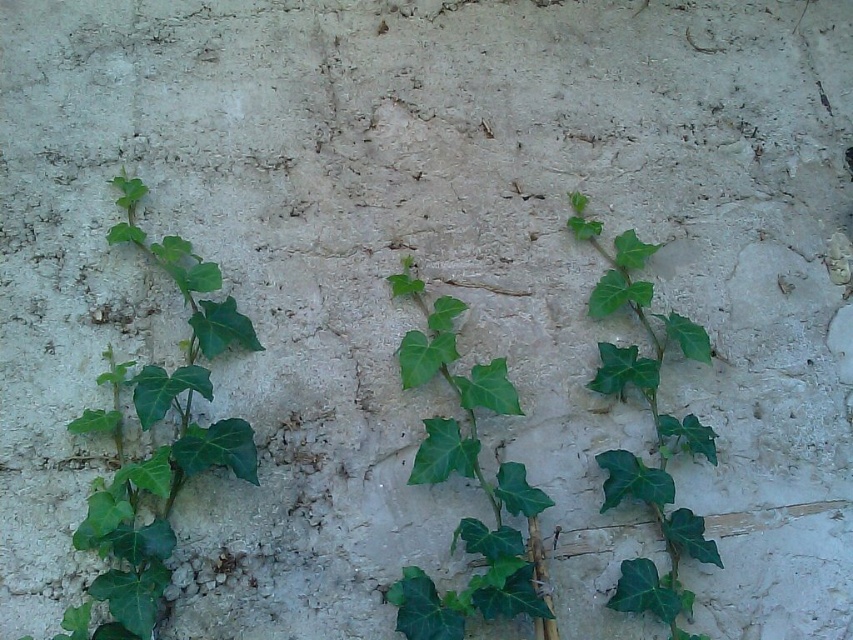
You are a painter standing 5 feet away from the wall. You want to paint the green leafy vine at center. Can you reach it with your 3.5 feet long paintbrush?

The distance between you and the green leafy vine at center is 4.40 feet. Since your paintbrush is 3.5 feet long, which is shorter than the distance, you cannot reach the vine to paint it.

You are standing in front of the textured wall with ivy plants. There is a specific point marked at coordinates (160, 444). Which object on the wall does this point correspond to?

The point at coordinates (160, 444) corresponds to the green leafy vine at left.

You are a gardener planning to install a trellis between the green leafy vine at left and the green leafy vine at right. The trellis requires at least 20 inches of space to fit properly. Based on the image, will the available space between the two vines accommodate the trellis?

The distance between the green leafy vine at left and the green leafy vine at right is 22.43 inches, which is more than the required 20 inches. Therefore, the trellis can be installed between them.